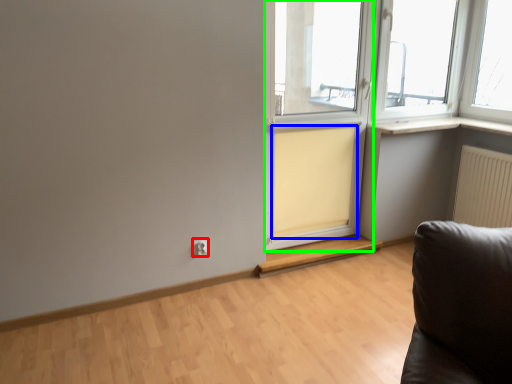
Question: Estimate the real-world distances between objects in this image. Which object is farther from electric outlet (highlighted by a red box), curtain (highlighted by a blue box) or screen door (highlighted by a green box)?

Choices:
 (A) curtain
 (B) screen door

Answer: (B)